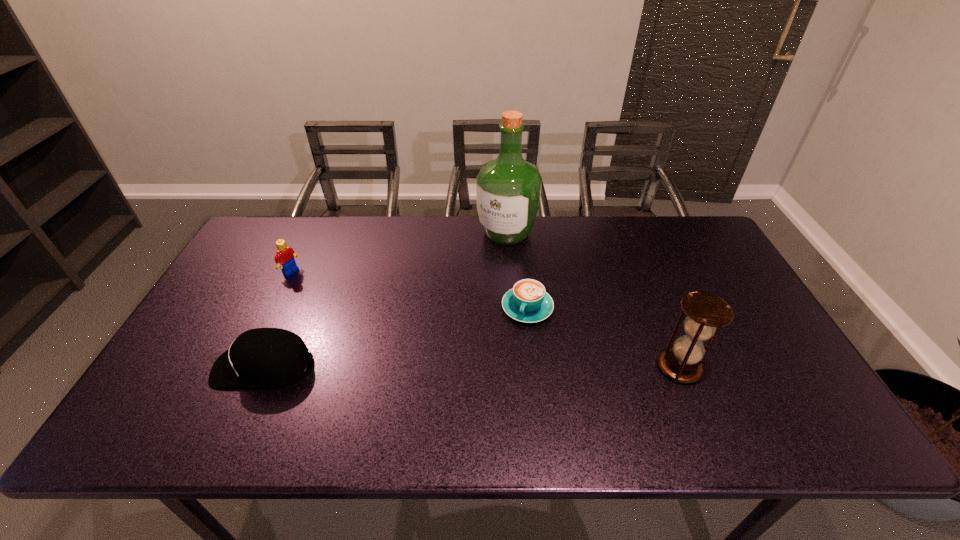
The width and height of the screenshot is (960, 540). I want to click on blank space located 0.110m on the front-facing side of the second shortest object, so click(x=171, y=366).

At what (x,y) coordinates should I click in order to perform the action: click on free spot located 0.050m on the front-facing side of the second shortest object. Please return your answer as a coordinate pair (x, y). The width and height of the screenshot is (960, 540). Looking at the image, I should click on pyautogui.click(x=195, y=366).

I want to click on free space located on the right of the rightmost object, so click(778, 367).

Find the location of `vacant space located with the handle on the right side of the third nearest object`. vacant space located with the handle on the right side of the third nearest object is located at coordinates (500, 372).

Image resolution: width=960 pixels, height=540 pixels. In order to click on vacant space located with the handle on the right side of the third nearest object in this screenshot , I will do `click(495, 384)`.

Locate an element on the screen. The image size is (960, 540). vacant space situated with the handle on the right side of the third nearest object is located at coordinates (500, 372).

Locate an element on the screen. This screenshot has width=960, height=540. free point located 0.340m on the front-facing side of the Lego is located at coordinates (378, 321).

Image resolution: width=960 pixels, height=540 pixels. Find the location of `vacant region located on the front-facing side of the Lego`. vacant region located on the front-facing side of the Lego is located at coordinates (354, 308).

Image resolution: width=960 pixels, height=540 pixels. I want to click on vacant space located on the front-facing side of the Lego, so click(381, 323).

Identify the location of vacant region located on the front-facing side of the liquor. (450, 311).